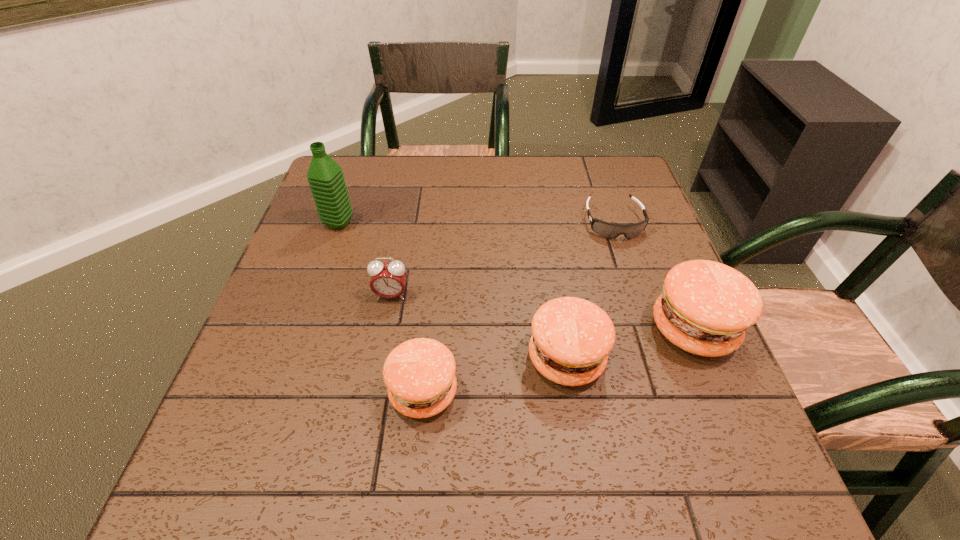
The image size is (960, 540). What are the coordinates of `free location located 0.140m on the back of the rightmost patty` in the screenshot? It's located at (661, 254).

I want to click on free location located on the back of the tallest object, so click(x=353, y=182).

Find the location of a particular element. free location located on the front and sides of the shortest object is located at coordinates (650, 329).

Where is `vacant space located 0.160m on the clock face of the alarm clock`? The image size is (960, 540). vacant space located 0.160m on the clock face of the alarm clock is located at coordinates (378, 366).

Locate an element on the screen. The image size is (960, 540). object at the left edge is located at coordinates (325, 177).

This screenshot has height=540, width=960. In order to click on patty positioned at the right edge in this screenshot , I will do `click(705, 308)`.

At what (x,y) coordinates should I click in order to perform the action: click on goggles located at the right edge. Please return your answer as a coordinate pair (x, y). This screenshot has width=960, height=540. Looking at the image, I should click on (607, 230).

At what (x,y) coordinates should I click in order to perform the action: click on vacant space at the far edge. Please return your answer as a coordinate pair (x, y). This screenshot has width=960, height=540. Looking at the image, I should click on (492, 187).

This screenshot has height=540, width=960. In order to click on free space at the near edge of the desktop in this screenshot , I will do `click(389, 399)`.

Identify the location of free spot at the left edge of the desktop. This screenshot has width=960, height=540. (261, 321).